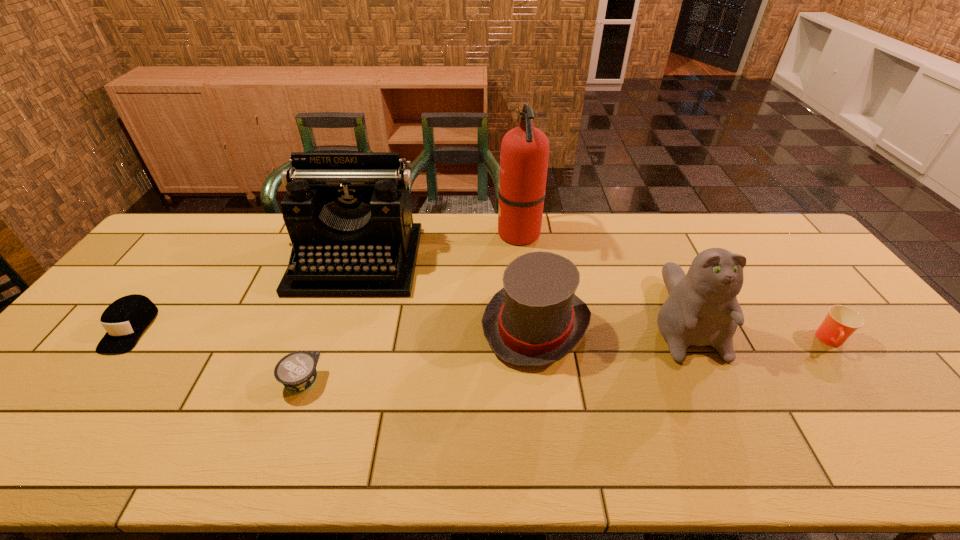
At what (x,y) coordinates should I click in order to perform the action: click on free location that satisfies the following two spatial constraints: 1. on the typing side of the typewriter; 2. on the left side of the cup. Please return your answer as a coordinate pair (x, y). This screenshot has width=960, height=540. Looking at the image, I should click on (330, 341).